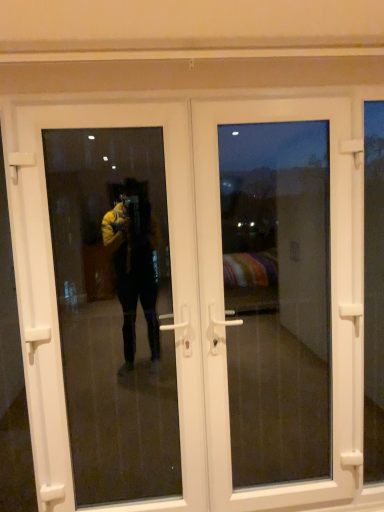
Find the location of `free space above white plastic door at center, which ranks as the second door in left-to-right order (from a real-world perspective)`. free space above white plastic door at center, which ranks as the second door in left-to-right order (from a real-world perspective) is located at coordinates click(259, 93).